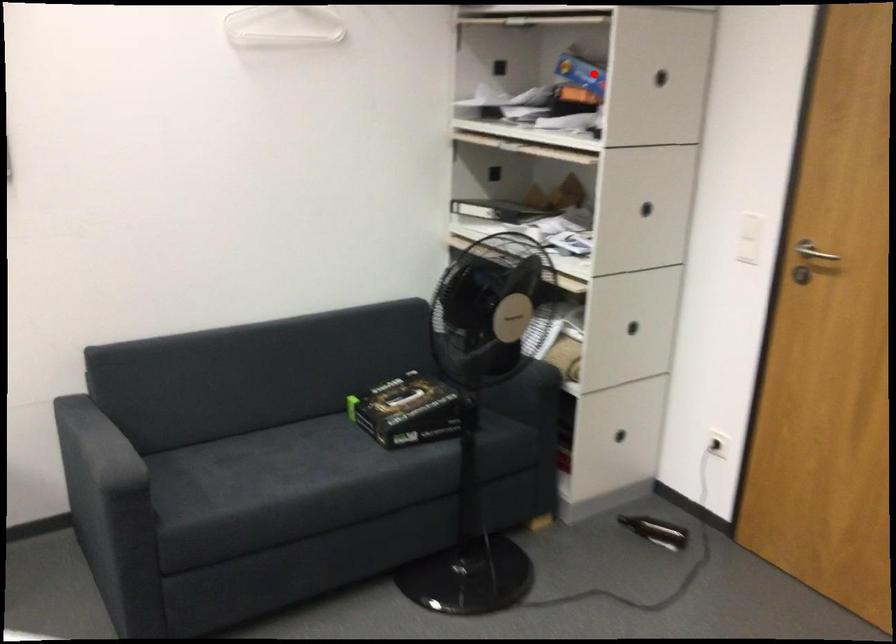
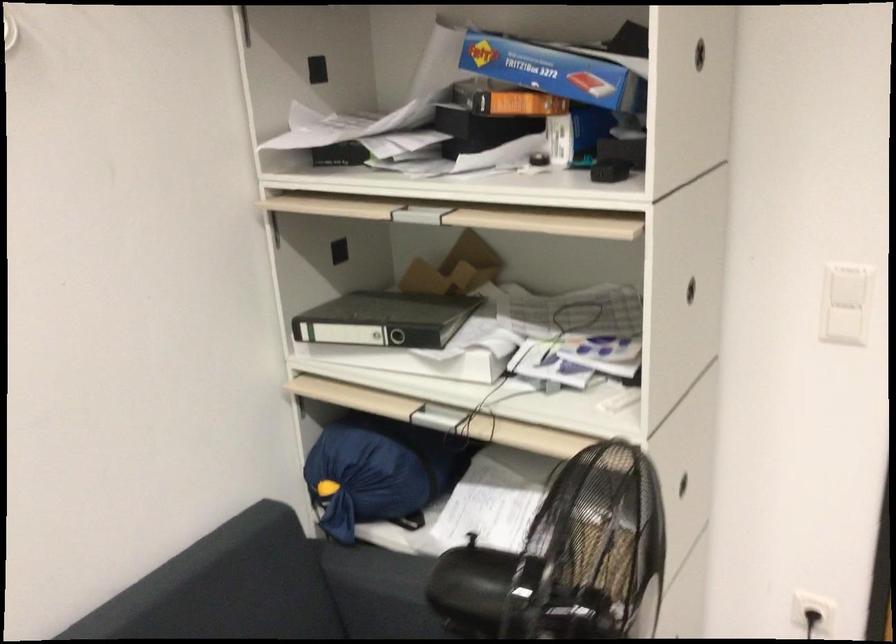
Locate, in the second image, the point that corresponds to the highlighted location in the first image.

(553, 71)